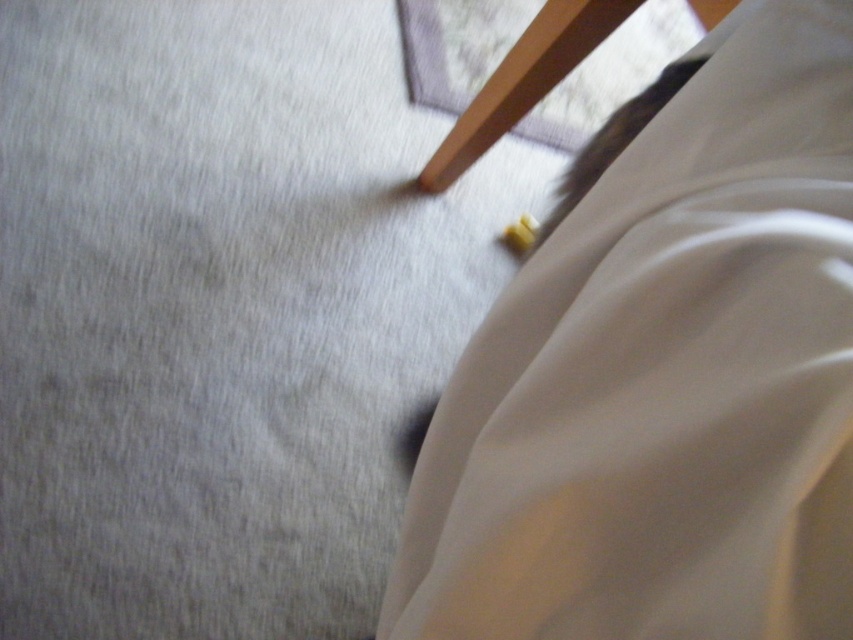
Between beige satin sheet at lower right and wooden chair at upper center, which one is positioned higher?

wooden chair at upper center is above.

Is beige satin sheet at lower right further to the viewer compared to wooden chair at upper center?

No, beige satin sheet at lower right is in front of wooden chair at upper center.

This screenshot has width=853, height=640. Describe the element at coordinates (664, 380) in the screenshot. I see `beige satin sheet at lower right` at that location.

The width and height of the screenshot is (853, 640). I want to click on beige satin sheet at lower right, so click(x=664, y=380).